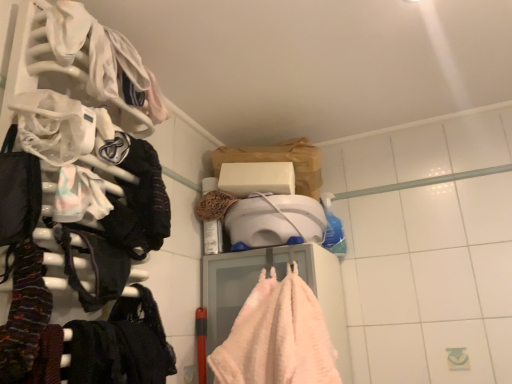
Question: Is the surface of pastel cotton bib at left, which appears as the first clothing when viewed from the top, in direct contact with white plastic hanger at left?

Choices:
 (A) yes
 (B) no

Answer: (B)

Question: Does pastel cotton bib at left, which appears as the first clothing when viewed from the top, have a lesser height compared to white plastic hanger at left?

Choices:
 (A) no
 (B) yes

Answer: (B)

Question: Is pastel cotton bib at left, the second clothing from the bottom, far from white plastic hanger at left?

Choices:
 (A) yes
 (B) no

Answer: (B)

Question: From a real-world perspective, is pastel cotton bib at left, which ranks as the second clothing in front-to-back order, located beneath white plastic hanger at left?

Choices:
 (A) no
 (B) yes

Answer: (B)

Question: From the image's perspective, is pastel cotton bib at left, which ranks as the 1th clothing in back-to-front order, located above white plastic hanger at left?

Choices:
 (A) yes
 (B) no

Answer: (B)

Question: Considering the positions of pastel cotton bib at left, the second clothing from the bottom, and knitted wool scarf at left, marked as the 2th clothing in a top-to-bottom arrangement, in the image, is pastel cotton bib at left, the second clothing from the bottom, wider or thinner than knitted wool scarf at left, marked as the 2th clothing in a top-to-bottom arrangement,?

Choices:
 (A) thin
 (B) wide

Answer: (B)

Question: Does point (61, 203) appear closer or farther from the camera than point (34, 307)?

Choices:
 (A) closer
 (B) farther

Answer: (B)

Question: From the image's perspective, is pastel cotton bib at left, which ranks as the 1th clothing in back-to-front order, above or below knitted wool scarf at left, marked as the 2th clothing in a top-to-bottom arrangement?

Choices:
 (A) above
 (B) below

Answer: (A)

Question: From a real-world perspective, is pastel cotton bib at left, which ranks as the 1th clothing in back-to-front order, positioned above or below knitted wool scarf at left, the 2th clothing viewed from the back?

Choices:
 (A) below
 (B) above

Answer: (B)

Question: Is knitted wool scarf at left, the 2th clothing viewed from the back, spatially inside white plastic hanger at left, or outside of it?

Choices:
 (A) inside
 (B) outside

Answer: (A)

Question: Based on their sizes in the image, would you say knitted wool scarf at left, marked as the 2th clothing in a top-to-bottom arrangement, is bigger or smaller than white plastic hanger at left?

Choices:
 (A) small
 (B) big

Answer: (A)

Question: Would you say knitted wool scarf at left, arranged as the first clothing when viewed from the front, is to the left or to the right of white plastic hanger at left in the picture?

Choices:
 (A) left
 (B) right

Answer: (B)

Question: In terms of width, does knitted wool scarf at left, marked as the 2th clothing in a top-to-bottom arrangement, look wider or thinner when compared to white plastic hanger at left?

Choices:
 (A) wide
 (B) thin

Answer: (B)

Question: From a real-world perspective, relative to pastel cotton bib at left, which appears as the first clothing when viewed from the top, is white plastic hanger at left vertically above or below?

Choices:
 (A) above
 (B) below

Answer: (A)

Question: In terms of height, does white plastic hanger at left look taller or shorter compared to pastel cotton bib at left, which ranks as the second clothing in front-to-back order?

Choices:
 (A) tall
 (B) short

Answer: (A)